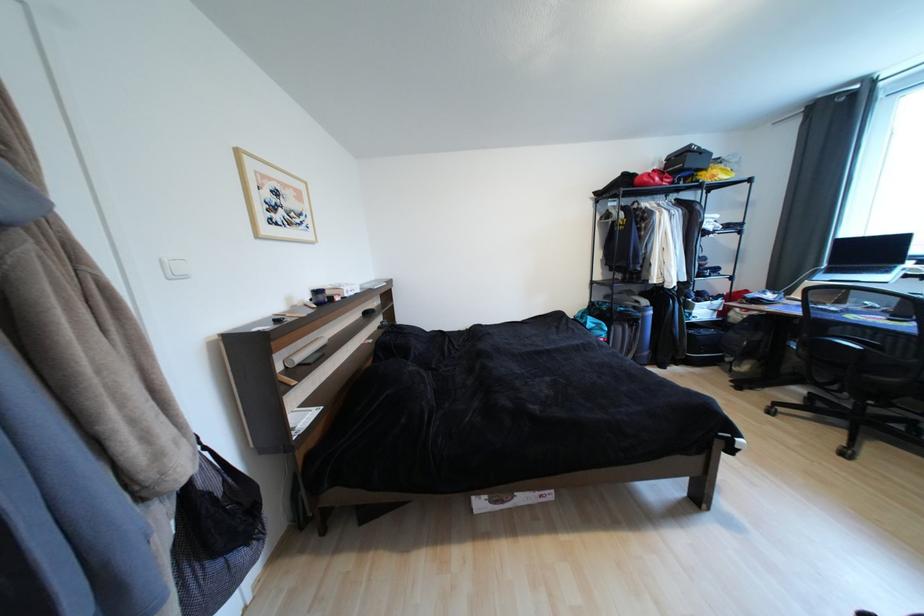
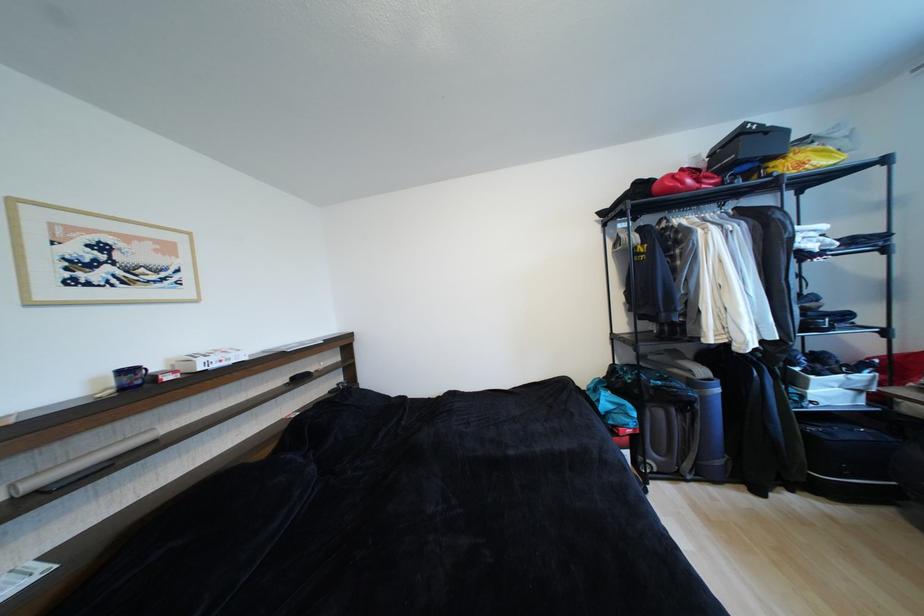
What movement of the cameraman would produce the second image?

The cameraman walked toward right, forward.